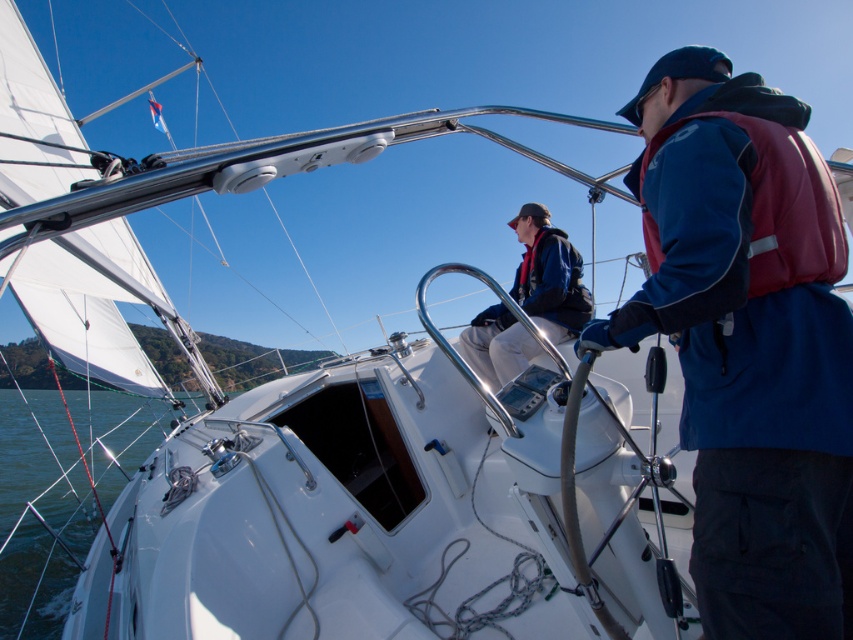
Question: Is blue fleece jacket at center thinner than maroon synthetic life jacket at right?

Choices:
 (A) yes
 (B) no

Answer: (B)

Question: Can you confirm if clear water at lower left is positioned to the right of maroon synthetic life jacket at right?

Choices:
 (A) yes
 (B) no

Answer: (B)

Question: Considering the real-world distances, which object is closest to the blue fabric jacket at center?

Choices:
 (A) clear water at lower left
 (B) maroon synthetic life jacket at right

Answer: (B)

Question: Which point appears closest to the camera in this image?

Choices:
 (A) (685, 141)
 (B) (4, 390)

Answer: (A)

Question: Considering the relative positions of clear water at lower left and maroon synthetic life jacket at right in the image provided, where is clear water at lower left located with respect to maroon synthetic life jacket at right?

Choices:
 (A) right
 (B) left

Answer: (B)

Question: Which point appears closest to the camera in this image?

Choices:
 (A) (553, 243)
 (B) (758, 160)
 (C) (79, 410)

Answer: (B)